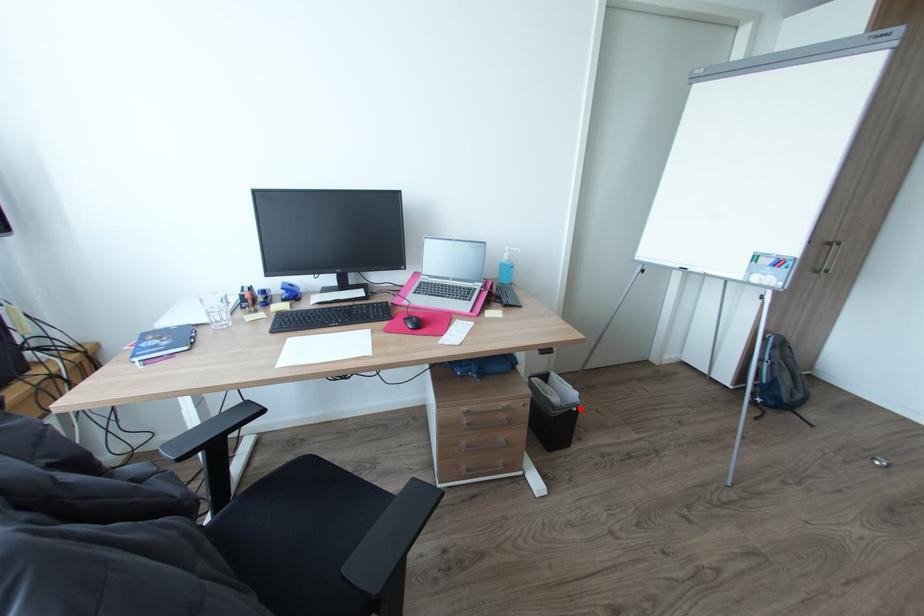
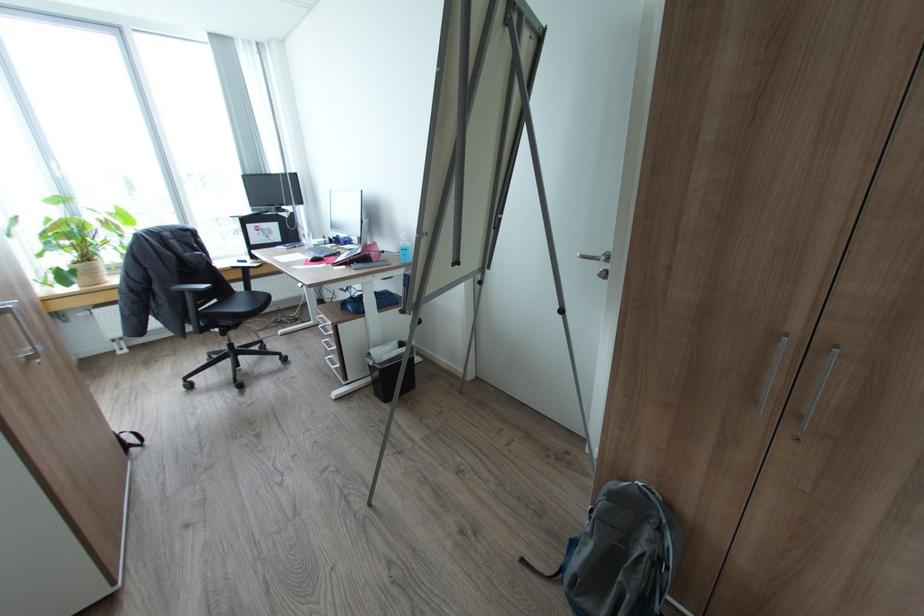
The point at the highlighted location is marked in the first image. Where is the corresponding point in the second image?

(374, 363)